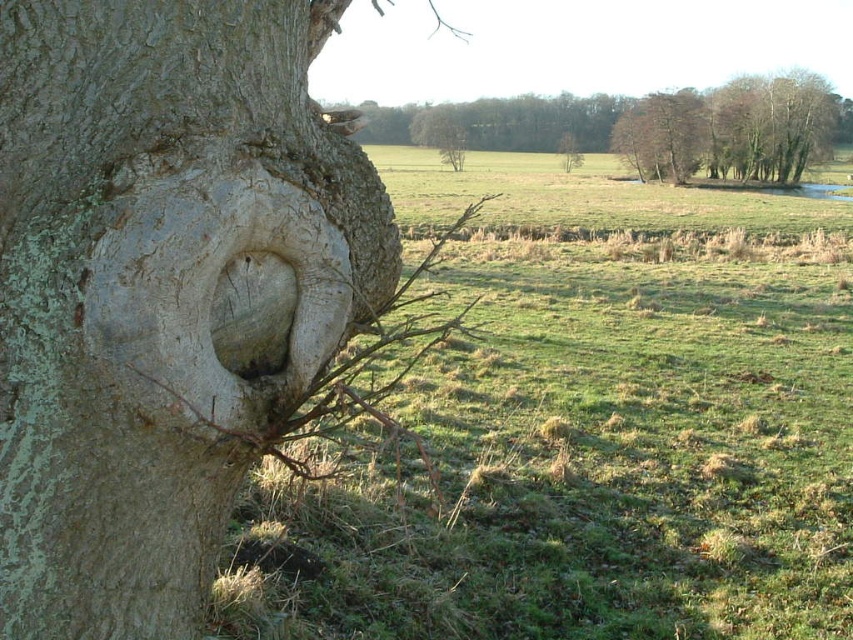
You are standing in the open field behind the tree trunk. You see two points marked in the image. Which point is closer to you, point (312,276) or point (363,392)?

Point (312,276) is in front of point (363,392), so it is closer to you.

Looking at this image, you are standing in the field and see the green grass at left and the smooth gray bark at center. Which object is closer to you?

The green grass at left is closer to you because it is in front of the smooth gray bark at center.